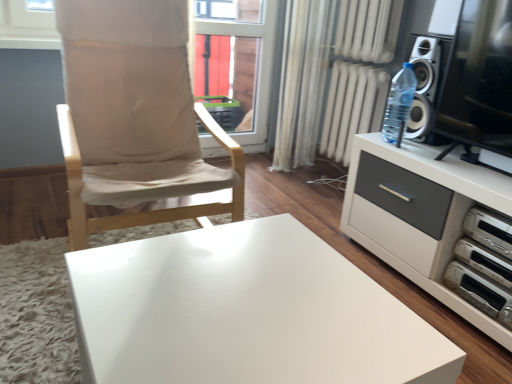
Locate an element on the screen. vacant space situated above white glossy table at center (from a real-world perspective) is located at coordinates (263, 332).